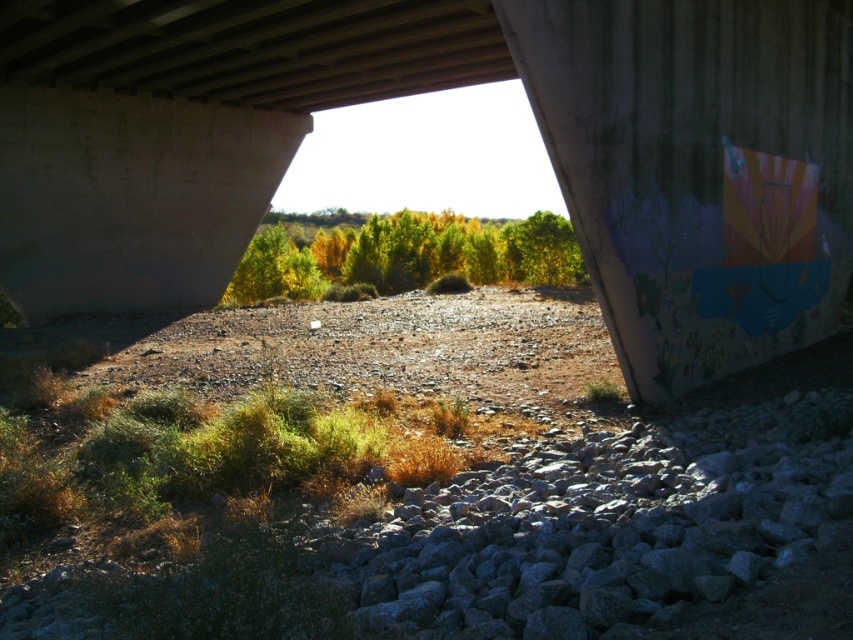
You are standing under a large concrete structure and looking at the rocky ground with scattered stones and grass. There is a point marked at coordinates (440, 88). What is located at that point?

Concrete at center is located at point (440, 88).

Looking at this image, you are standing under a large concrete structure and see the concrete at center and the green matte trees at center. Which object is positioned to the right side of the other?

The concrete at center is to the right of green matte trees at center.

You are a painter planning to paint a large mural on the concrete at center and the green matte trees at center. Which surface will require more paint due to its larger size?

The concrete at center requires more paint because it is larger in size than the green matte trees at center.